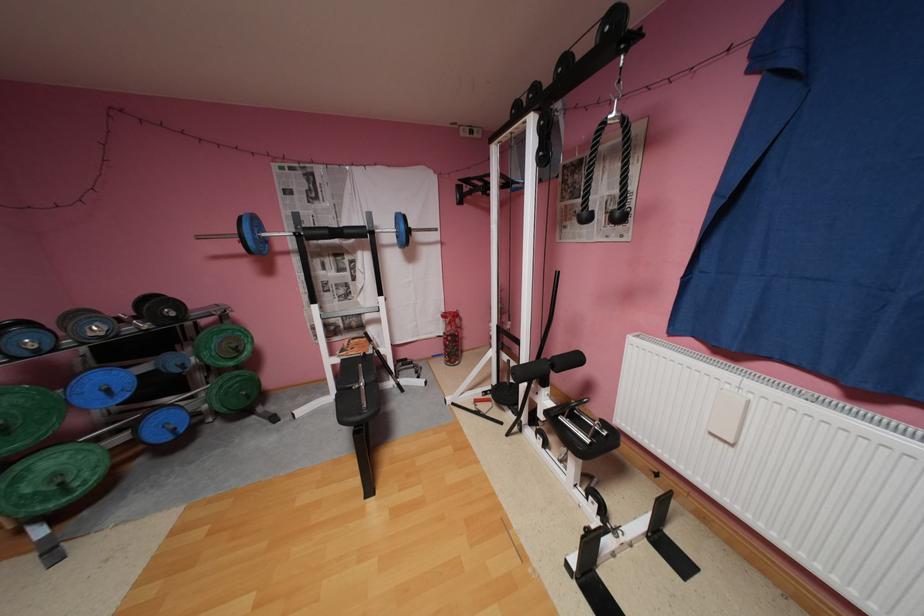
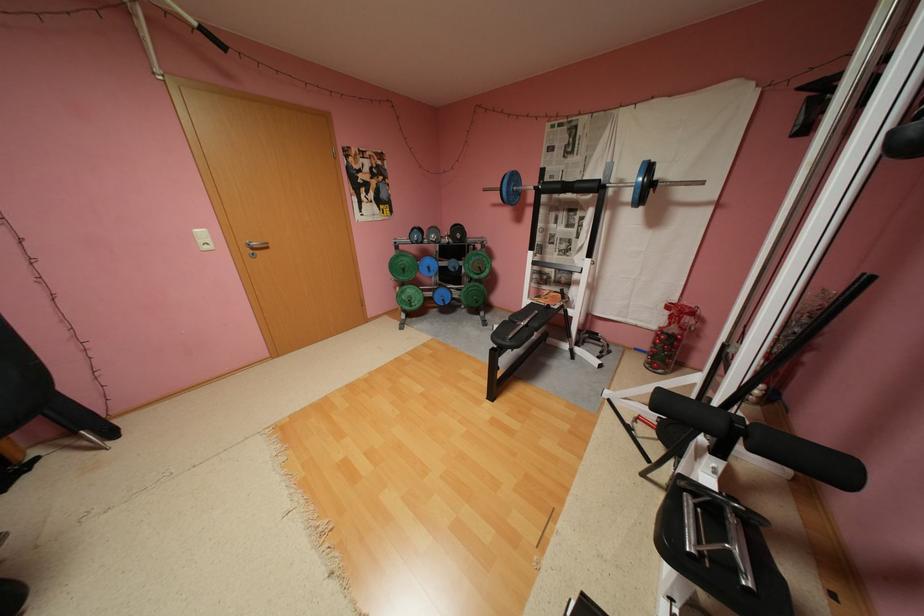
The point at (126, 390) is marked in the first image. Where is the corresponding point in the second image?

(441, 269)